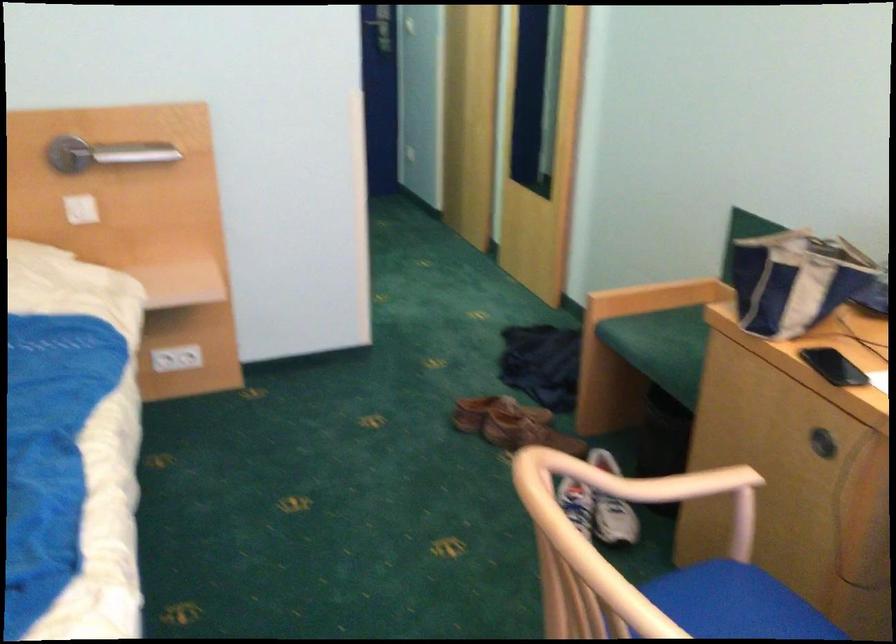
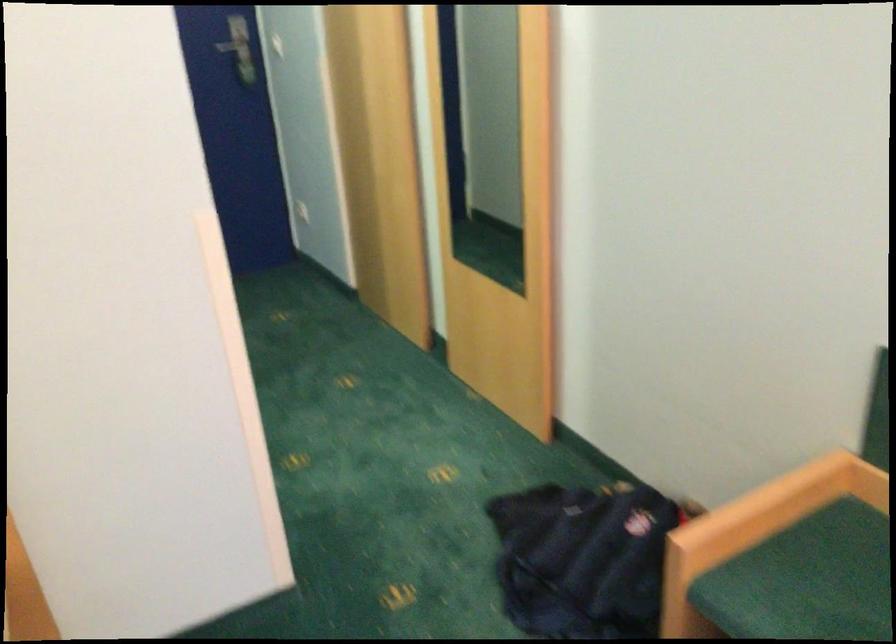
Find the pixel in the second image that matches point (661, 321) in the first image.

(806, 580)